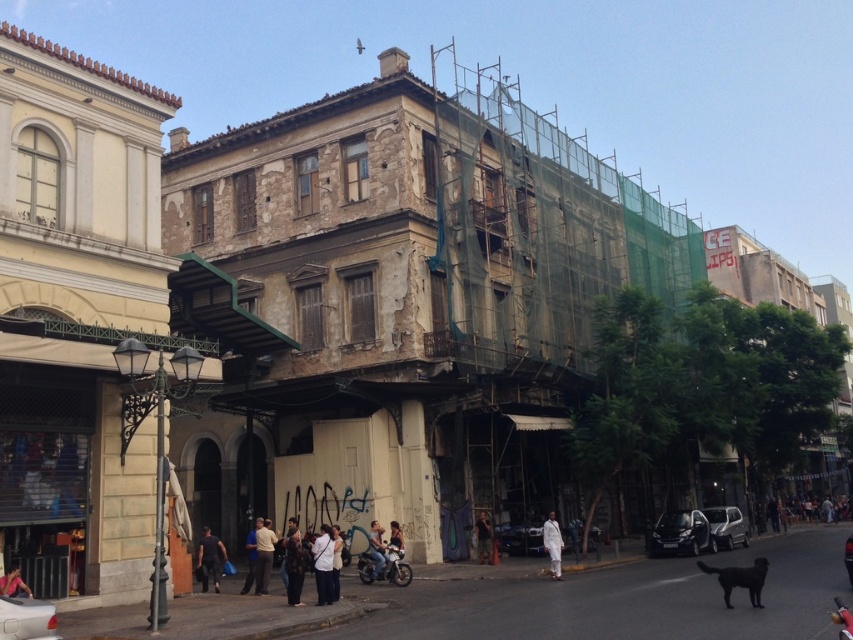
Which is in front, point (260, 566) or point (401, 552)?

Positioned in front is point (260, 566).

From the picture: Which is above, light brown leather jacket at center or dark blue jeans at center?

dark blue jeans at center is higher up.

Between point (265, 531) and point (398, 532), which one is positioned behind?

The point (398, 532) is behind.

This screenshot has height=640, width=853. In order to click on light brown leather jacket at center in this screenshot , I will do `click(263, 556)`.

Can you confirm if white matte shirt at center is shorter than dark blue jeans at center?

No.

Between white matte shirt at center and dark blue jeans at center, which one is positioned higher?

white matte shirt at center

The image size is (853, 640). I want to click on white matte shirt at center, so click(x=323, y=564).

This screenshot has height=640, width=853. What are the coordinates of `white matte shirt at center` in the screenshot? It's located at (323, 564).

Is dark blue jeans at lower left wider than light blue jeans at center?

Indeed, dark blue jeans at lower left has a greater width compared to light blue jeans at center.

This screenshot has width=853, height=640. Describe the element at coordinates (209, 557) in the screenshot. I see `dark blue jeans at lower left` at that location.

Where is `dark blue jeans at lower left`? This screenshot has height=640, width=853. dark blue jeans at lower left is located at coordinates (209, 557).